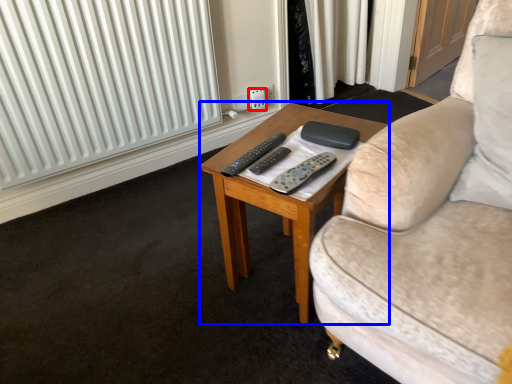
Question: Which point is further to the camera, electric outlet (highlighted by a red box) or coffee table (highlighted by a blue box)?

Choices:
 (A) electric outlet
 (B) coffee table

Answer: (A)